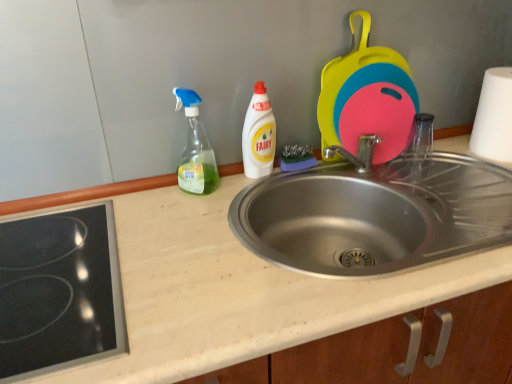
Find the location of a particular element. The width and height of the screenshot is (512, 384). vacant space that is to the left of white plastic bottle at center, which is the first bottle from right to left is located at coordinates (210, 191).